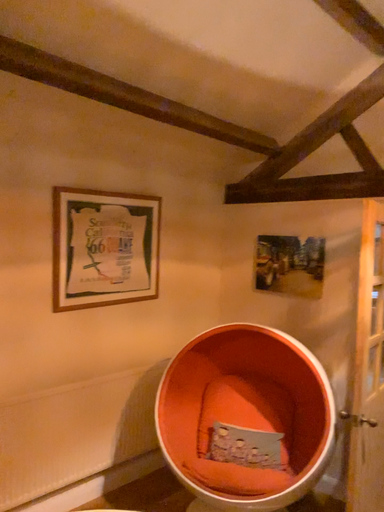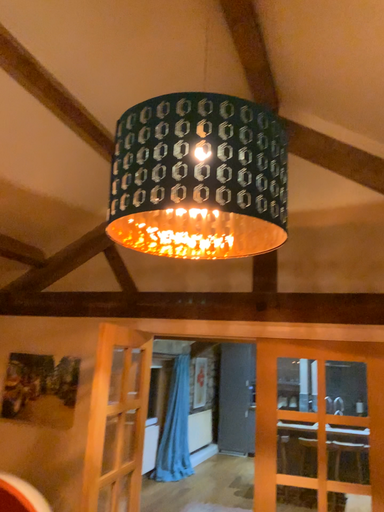
Question: How did the camera likely rotate when shooting the video?

Choices:
 (A) rotated left
 (B) rotated right

Answer: (B)